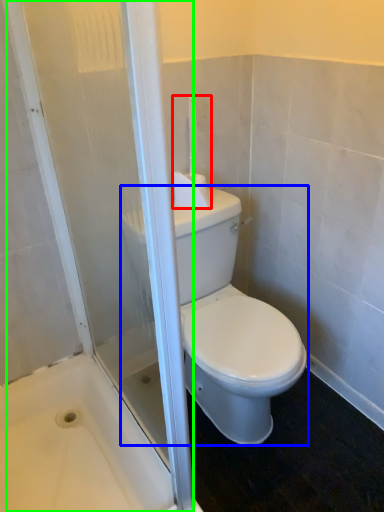
Question: Based on their relative distances, which object is nearer to towel bar (highlighted by a red box)? Choose from porcelain (highlighted by a blue box) and screen door (highlighted by a green box).

Choices:
 (A) porcelain
 (B) screen door

Answer: (A)